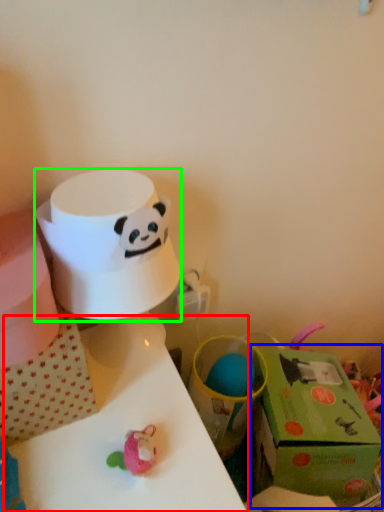
Question: Based on their relative distances, which object is farther from table (highlighted by a red box)? Choose from gift box (highlighted by a blue box) and paper towel (highlighted by a green box).

Choices:
 (A) gift box
 (B) paper towel

Answer: (A)